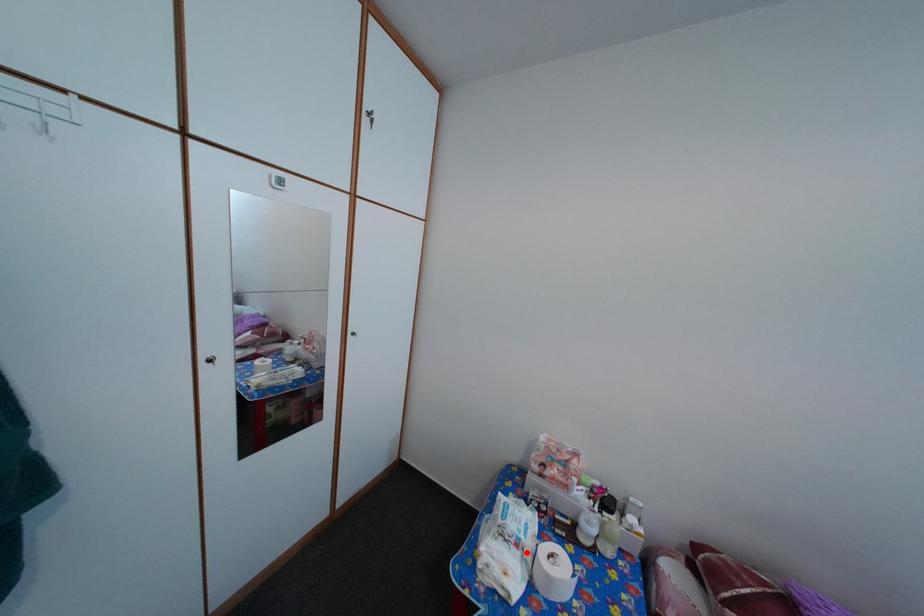
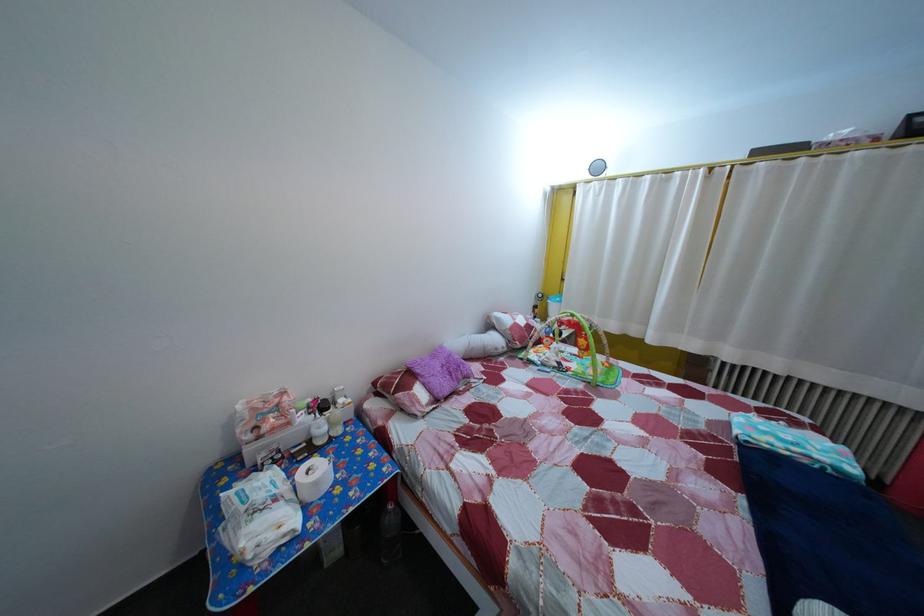
Find the pixel in the second image that matches the highlighted location in the first image.

(285, 508)